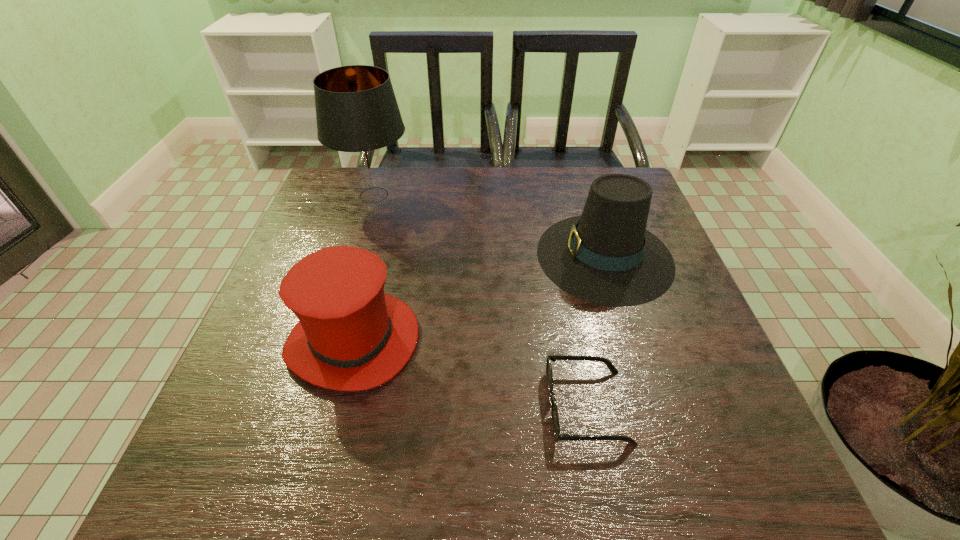
Identify the location of vacant space located 0.180m on the front-facing side of the shortest object. This screenshot has width=960, height=540. (445, 406).

Locate an element on the screen. free space located on the front-facing side of the shortest object is located at coordinates (457, 406).

The image size is (960, 540). What are the coordinates of `object located in the far edge section of the desktop` in the screenshot? It's located at pos(357,114).

In order to click on object that is at the near edge in this screenshot , I will do `click(554, 412)`.

Find the location of a particular element. The image size is (960, 540). lampshade at the left edge is located at coordinates [x=357, y=114].

Locate an element on the screen. hat located in the left edge section of the desktop is located at coordinates (351, 336).

At what (x,y) coordinates should I click in order to perform the action: click on object at the right edge. Please return your answer as a coordinate pair (x, y). The image size is (960, 540). Looking at the image, I should click on point(606,256).

Find the location of a particular element. The image size is (960, 540). object present at the far left corner is located at coordinates (357, 114).

Locate an element on the screen. free space at the far edge is located at coordinates (444, 177).

The height and width of the screenshot is (540, 960). In order to click on free spot at the near edge of the desktop in this screenshot , I will do `click(561, 492)`.